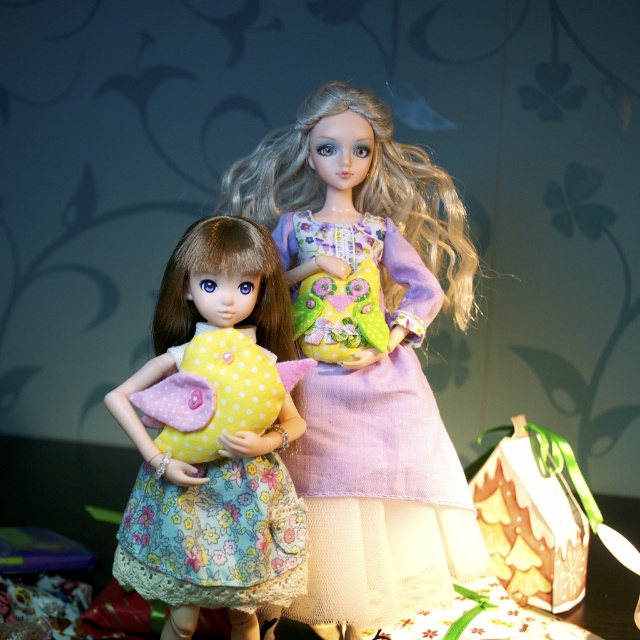
Question: Is lavender cotton dress at center positioned before floral fabric dress at center?

Choices:
 (A) no
 (B) yes

Answer: (A)

Question: Which point is farther to the camera?

Choices:
 (A) lavender cotton dress at center
 (B) floral fabric dress at center

Answer: (A)

Question: Among these points, which one is farthest from the camera?

Choices:
 (A) (413, 372)
 (B) (289, 474)

Answer: (A)

Question: Can you confirm if lavender cotton dress at center is smaller than floral fabric dress at center?

Choices:
 (A) yes
 (B) no

Answer: (B)

Question: Does lavender cotton dress at center have a smaller size compared to floral fabric dress at center?

Choices:
 (A) no
 (B) yes

Answer: (A)

Question: Which point is farther from the camera taking this photo?

Choices:
 (A) (230, 468)
 (B) (410, 513)

Answer: (B)